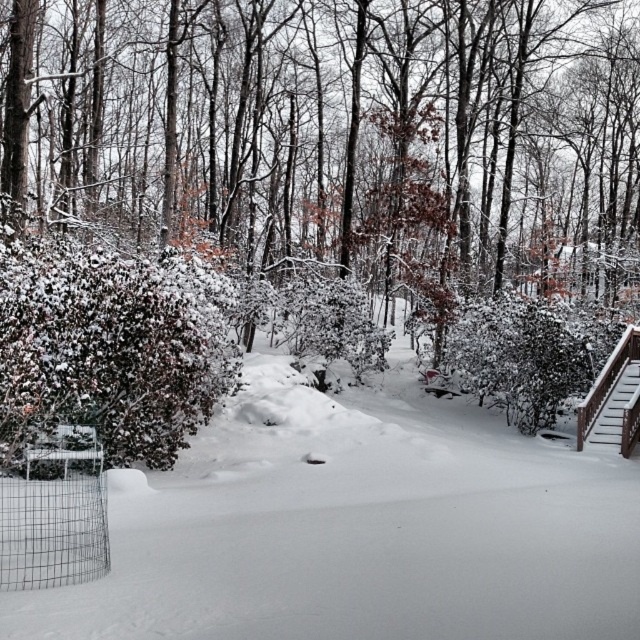
Question: Where is snow-covered bush at left located in relation to brown wooden stairs at right in the image?

Choices:
 (A) left
 (B) right

Answer: (A)

Question: Does snow-covered bush at left have a larger size compared to brown wooden stairs at right?

Choices:
 (A) yes
 (B) no

Answer: (B)

Question: Which point is closer to the camera taking this photo?

Choices:
 (A) (115, 269)
 (B) (604, 428)

Answer: (A)

Question: Can you confirm if snow-covered bush at left is thinner than brown wooden stairs at right?

Choices:
 (A) no
 (B) yes

Answer: (B)

Question: Among these points, which one is nearest to the camera?

Choices:
 (A) (604, 412)
 (B) (19, 301)

Answer: (B)